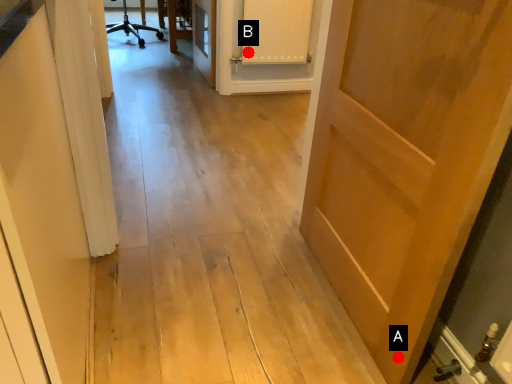
Question: Two points are circled on the image, labeled by A and B beside each circle. Which point is farther from the camera taking this photo?

Choices:
 (A) A is further
 (B) B is further

Answer: (B)